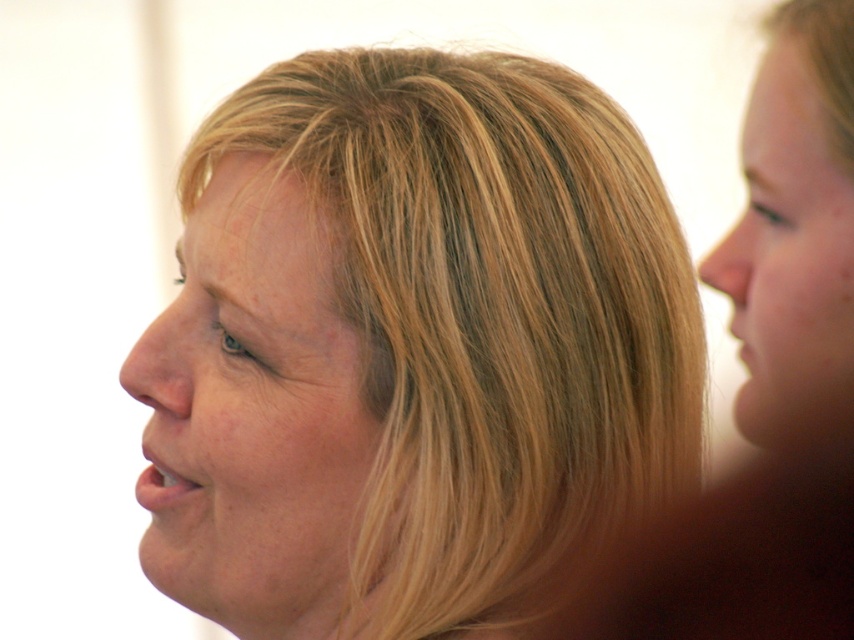
Which is above, blonde hair at center or smooth skin face at right?

smooth skin face at right is higher up.

Between blonde hair at center and smooth skin face at right, which one has more height?

Standing taller between the two is blonde hair at center.

Who is more forward, (278, 556) or (752, 384)?

Point (752, 384)

Where is `blonde hair at center`? Image resolution: width=854 pixels, height=640 pixels. blonde hair at center is located at coordinates (412, 349).

Is blonde hair at center below smooth skin face at center?

Actually, blonde hair at center is above smooth skin face at center.

This screenshot has height=640, width=854. In order to click on blonde hair at center in this screenshot , I will do `click(412, 349)`.

Where is `blonde hair at center`? Image resolution: width=854 pixels, height=640 pixels. blonde hair at center is located at coordinates (412, 349).

Does smooth skin face at center have a smaller size compared to smooth skin face at right?

No, smooth skin face at center is not smaller than smooth skin face at right.

Which is below, smooth skin face at center or smooth skin face at right?

Positioned lower is smooth skin face at center.

The width and height of the screenshot is (854, 640). In order to click on smooth skin face at center in this screenshot , I will do `click(254, 412)`.